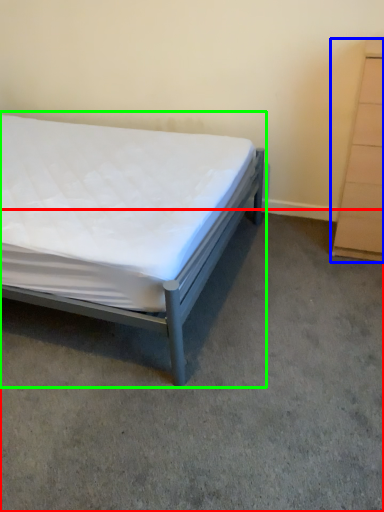
Question: Which object is the closest to the concrete (highlighted by a red box)? Choose among these: chest of drawers (highlighted by a blue box) or bed (highlighted by a green box).

Choices:
 (A) chest of drawers
 (B) bed

Answer: (B)